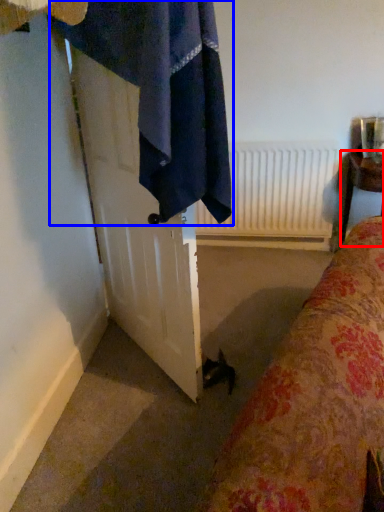
Question: Which object is closer to the camera taking this photo, furniture (highlighted by a red box) or bath towel (highlighted by a blue box)?

Choices:
 (A) furniture
 (B) bath towel

Answer: (B)